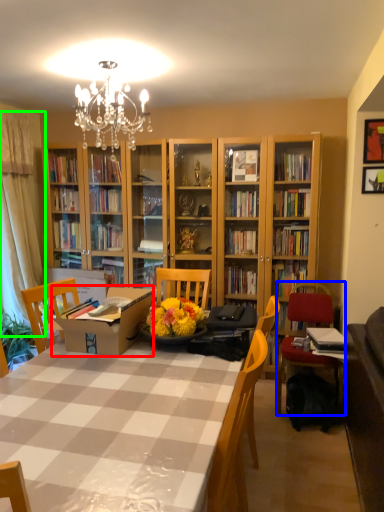
Question: Which object is positioned farthest from cardboard box (highlighted by a red box)? Select from chair (highlighted by a blue box) and curtain (highlighted by a green box).

Choices:
 (A) chair
 (B) curtain

Answer: (B)